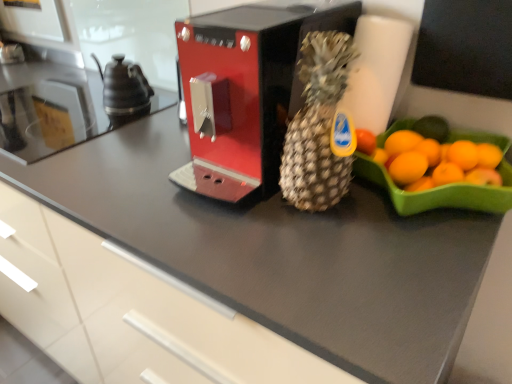
The image size is (512, 384). Identify the location of free spot in front of metallic red coffee machine at center. (295, 256).